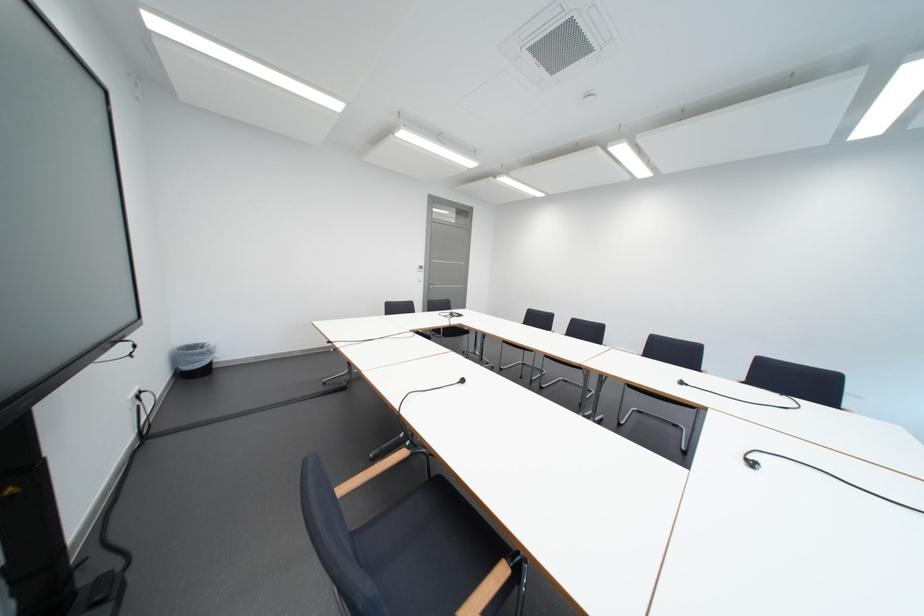
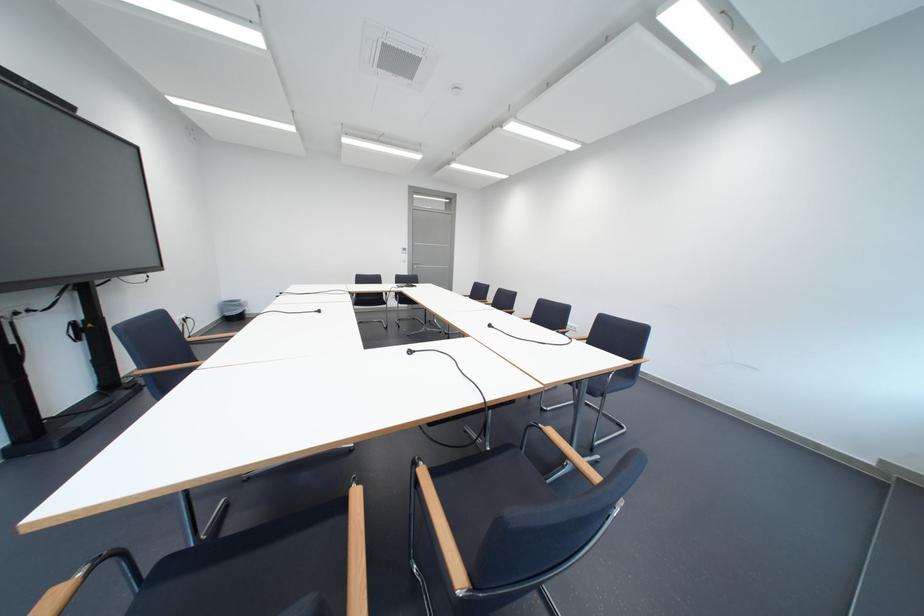
Locate, in the second image, the point that corresponds to the point at 442,286 in the first image.

(426, 265)